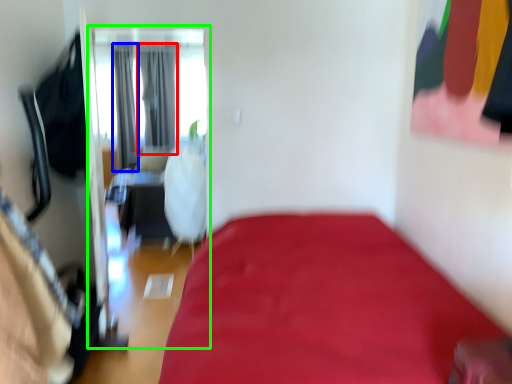
Question: Which object is the farthest from curtain (highlighted by a red box)? Choose among these: curtain (highlighted by a blue box) or screen door (highlighted by a green box).

Choices:
 (A) curtain
 (B) screen door

Answer: (A)